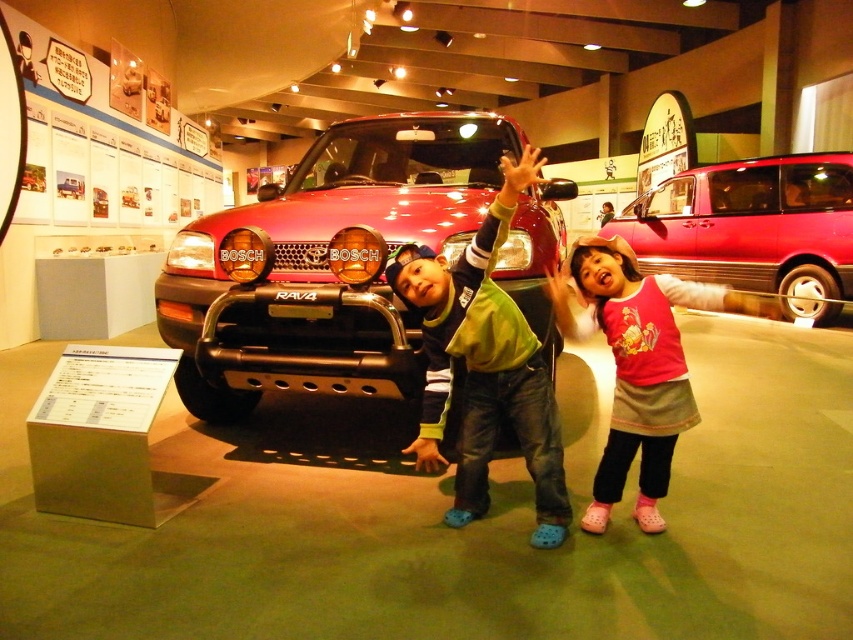
Is shiny red suv at center to the right of metallic red pickup truck at right from the viewer's perspective?

In fact, shiny red suv at center is to the left of metallic red pickup truck at right.

Who is positioned more to the left, shiny red suv at center or metallic red pickup truck at right?

Positioned to the left is shiny red suv at center.

This screenshot has width=853, height=640. Describe the element at coordinates (323, 262) in the screenshot. I see `shiny red suv at center` at that location.

Find the location of `shiny red suv at center`. shiny red suv at center is located at coordinates (323, 262).

Is point (283, 307) closer to camera compared to point (694, 403)?

That is False.

Does shiny red suv at center appear over pink fabric dress at center?

Yes, shiny red suv at center is above pink fabric dress at center.

Is point (366, 348) closer to camera compared to point (660, 528)?

No, (366, 348) is further to viewer.

Find the location of a particular element. shiny red suv at center is located at coordinates (323, 262).

Who is positioned more to the right, shiny red suv at center or green denim jeans at center?

green denim jeans at center

Between shiny red suv at center and green denim jeans at center, which one is positioned higher?

Positioned higher is shiny red suv at center.

Identify the location of shiny red suv at center. Image resolution: width=853 pixels, height=640 pixels. (323, 262).